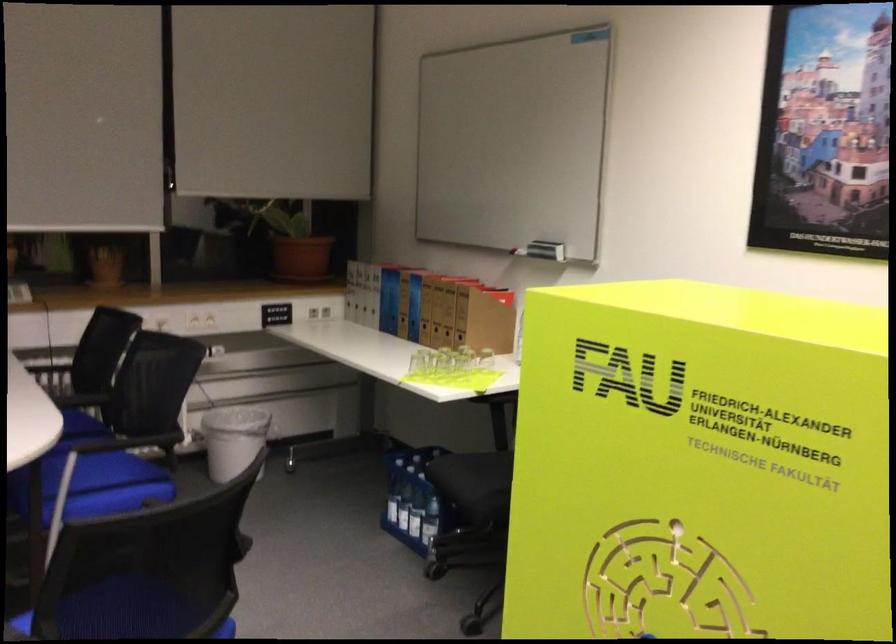
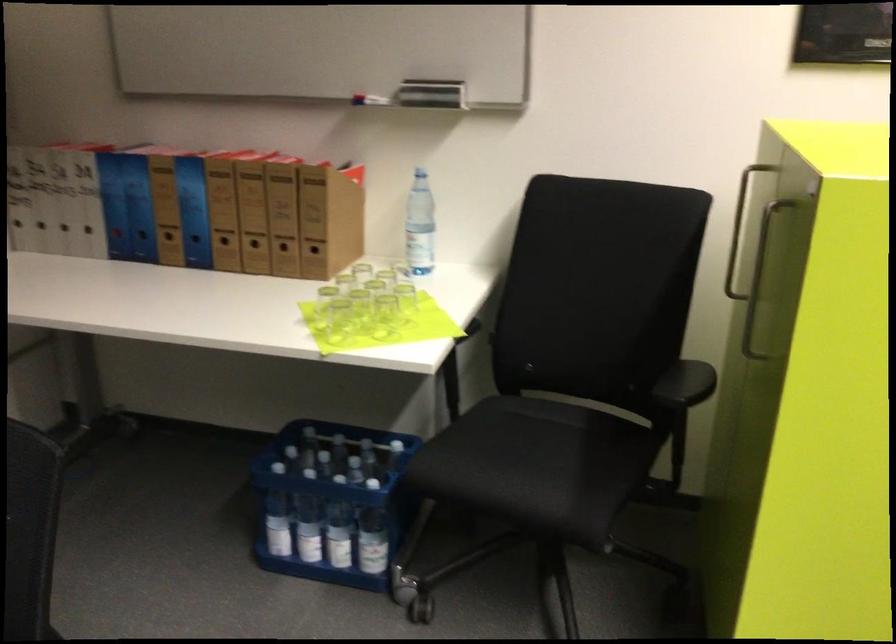
In the second image, find the point that corresponds to (459,375) in the first image.

(383, 316)